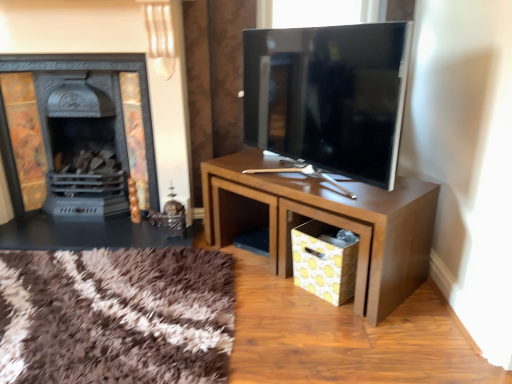
This screenshot has height=384, width=512. Find the location of `free space to the left of yellow paper drawer at lower right`. free space to the left of yellow paper drawer at lower right is located at coordinates (272, 293).